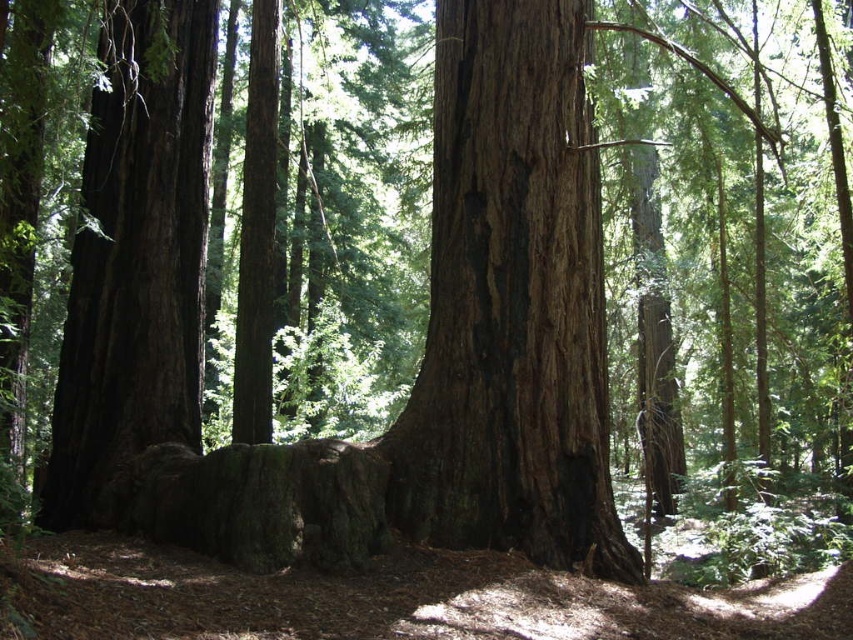
Question: Does dark brown rough bark tree trunk at center have a smaller size compared to dark brown wood at left?

Choices:
 (A) no
 (B) yes

Answer: (B)

Question: Which point is closer to the camera?

Choices:
 (A) dark brown wood at left
 (B) dark brown rough bark tree trunk at center

Answer: (B)

Question: Does dark brown rough bark tree trunk at center appear under dark brown wood at left?

Choices:
 (A) yes
 (B) no

Answer: (A)

Question: Can you confirm if dark brown rough bark tree trunk at center is smaller than dark brown wood at left?

Choices:
 (A) no
 (B) yes

Answer: (B)

Question: Which point appears closest to the camera in this image?

Choices:
 (A) (440, 429)
 (B) (177, 205)

Answer: (A)